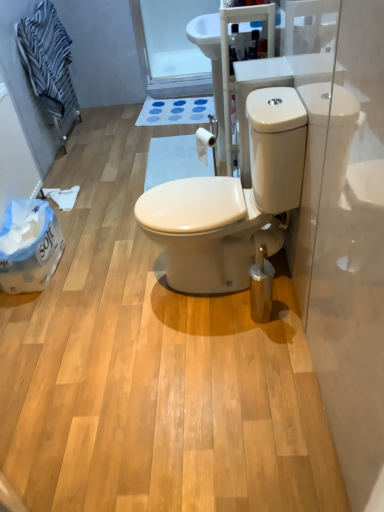
Question: Considering the positions of point (31, 249) and point (74, 117), is point (31, 249) closer or farther from the camera than point (74, 117)?

Choices:
 (A) farther
 (B) closer

Answer: (B)

Question: From a real-world perspective, is white plastic bag at left positioned above or below blue striped towel at upper left?

Choices:
 (A) below
 (B) above

Answer: (A)

Question: Which object is positioned closest to the blue striped towel at upper left?

Choices:
 (A) blue rubber bath mat at center
 (B) white plastic bag at left
 (C) white glossy toilet at center
 (D) transparent glass door at upper center
 (E) white matte toilet paper at upper center

Answer: (A)

Question: Which object is the farthest from the white plastic bag at left?

Choices:
 (A) white matte toilet paper at upper center
 (B) blue striped towel at upper left
 (C) blue rubber bath mat at center
 (D) white glossy toilet at center
 (E) transparent glass door at upper center

Answer: (E)